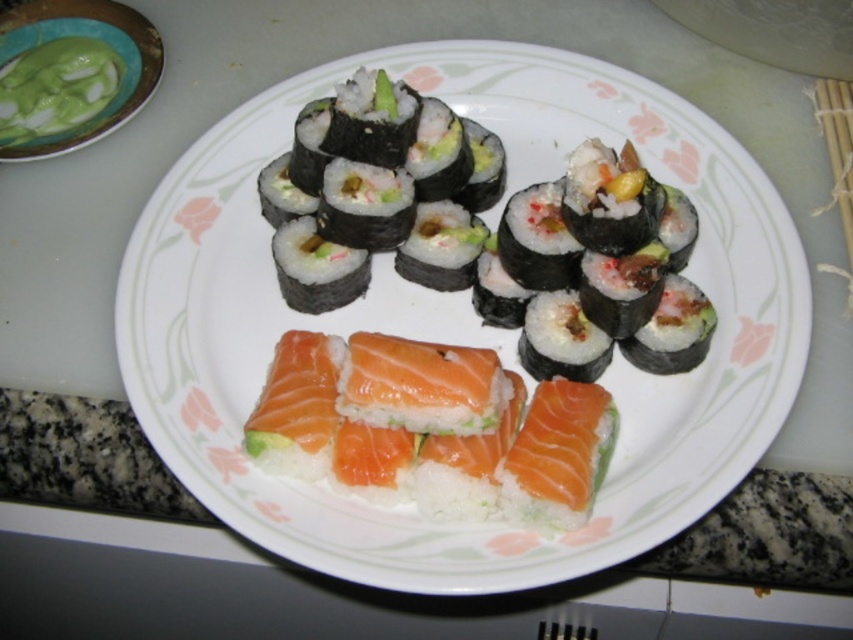
Between white glossy plate at center and black nori wrapped sushi at center, which one appears on the right side from the viewer's perspective?

black nori wrapped sushi at center is more to the right.

Identify the location of white glossy plate at center. (460, 323).

Identify the location of white glossy plate at center. (460, 323).

Based on the photo, can you confirm if black nori wrapped sushi at center is positioned to the right of green matte bowl at upper left?

Correct, you'll find black nori wrapped sushi at center to the right of green matte bowl at upper left.

Does black nori wrapped sushi at center appear over green matte bowl at upper left?

Actually, black nori wrapped sushi at center is below green matte bowl at upper left.

Locate an element on the screen. Image resolution: width=853 pixels, height=640 pixels. black nori wrapped sushi at center is located at coordinates (503, 227).

Is white glossy plate at center to the left of green matte bowl at upper left from the viewer's perspective?

No, white glossy plate at center is not to the left of green matte bowl at upper left.

Does point (219, 225) lie behind point (83, 92)?

That is False.

The height and width of the screenshot is (640, 853). I want to click on white glossy plate at center, so click(x=460, y=323).